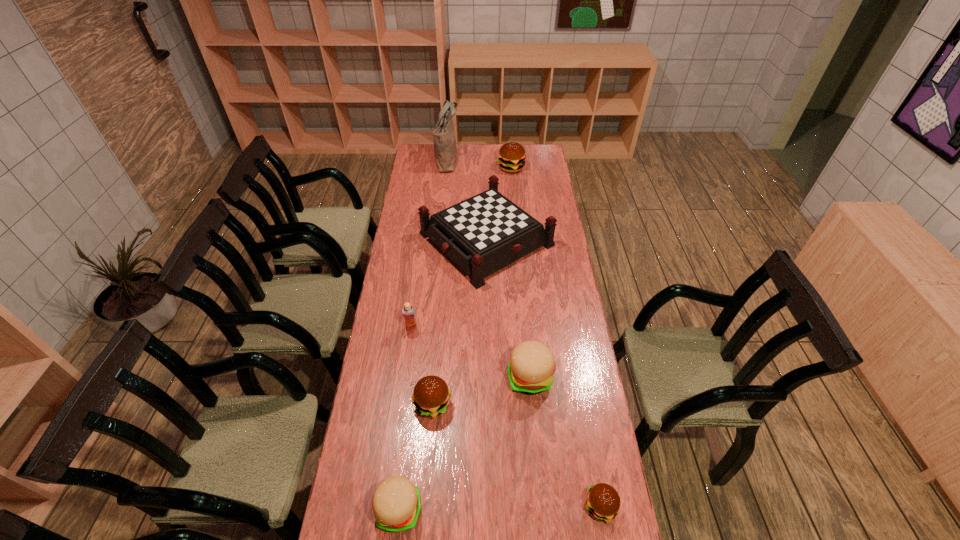
The width and height of the screenshot is (960, 540). Identify the location of empty location between the fourth farthest object and the leftmost brown hamburger. (422, 366).

Locate an element on the screen. blank region between the rightmost hamburger and the left beige hamburger is located at coordinates (499, 508).

Identify which object is the fourth nearest to the tallest object. Please provide its 2D coordinates. Your answer should be formatted as a tuple, i.e. [(x, y)], where the tuple contains the x and y coordinates of a point satisfying the conditions above.

[(531, 367)]

Where is `object that is the nearest to the farthest brown hamburger`? This screenshot has height=540, width=960. object that is the nearest to the farthest brown hamburger is located at coordinates (483, 234).

Find the location of `hamburger that is the fourth closest to the farther beige hamburger`. hamburger that is the fourth closest to the farther beige hamburger is located at coordinates (511, 157).

This screenshot has height=540, width=960. Identify the location of hamburger that stands as the second closest to the second brown hamburger from right to left. (431, 396).

Point out which brown hamburger is positioned as the third nearest to the red checkerboard. Please provide its 2D coordinates. Your answer should be formatted as a tuple, i.e. [(x, y)], where the tuple contains the x and y coordinates of a point satisfying the conditions above.

[(603, 502)]

Identify which brown hamburger is the second nearest to the biggest brown hamburger. Please provide its 2D coordinates. Your answer should be formatted as a tuple, i.e. [(x, y)], where the tuple contains the x and y coordinates of a point satisfying the conditions above.

[(603, 502)]

Identify the location of the closest beige hamburger to the sixth nearest object. This screenshot has width=960, height=540. (531, 367).

I want to click on beige hamburger that can be found as the second closest to the second smallest brown hamburger, so click(x=396, y=501).